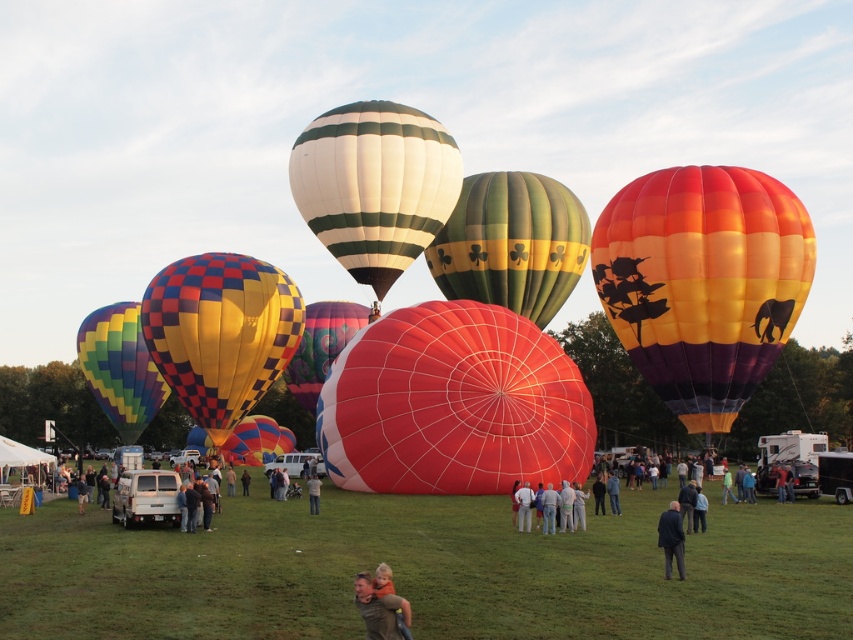
You are standing in the grassy field at the hot air balloon festival and want to take a photo of the green striped balloon at center. If you move 0.1 units to the right, will you still be able to see the entire balloon?

The green striped balloon at center is located at point (x=511, y=243). Moving 0.1 units to the right would adjust your position, but since the balloon is centrally positioned, you should still be able to see the entire balloon unless there are obstructions not mentioned in the scene description.

You are a photographer standing in the field and want to capture a photo of the matte red balloon at center and the green fabric shirt at center. Based on their positions, which one should you focus on first to ensure both are in the frame?

The matte red balloon at center is above the green fabric shirt at center, so you should focus on the green fabric shirt at center first to ensure both are in the frame.

You are a photographer standing in the field and want to take a photo of both the matte red balloon at center and the green fabric shirt at center. Which object should you focus on first to ensure both are in the frame?

The matte red balloon at center is closer to the viewer than the green fabric shirt at center, so you should focus on the matte red balloon at center first to ensure both are in the frame.